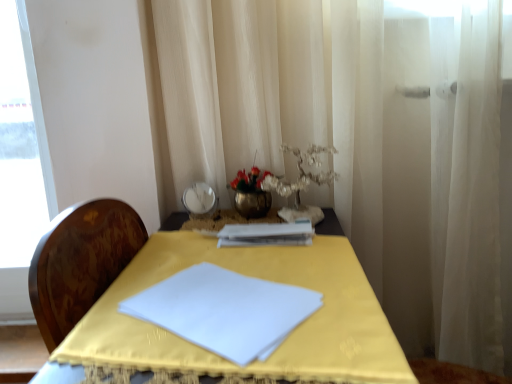
You are a GUI agent. You are given a task and a screenshot of the screen. Output one action in this format:
    pyautogui.click(x=<x>, y=<y>)
    Task: Click on the free space in front of matte silver bowl at upper center
    The image size is (512, 384).
    Given the screenshot: What is the action you would take?
    pyautogui.click(x=196, y=233)